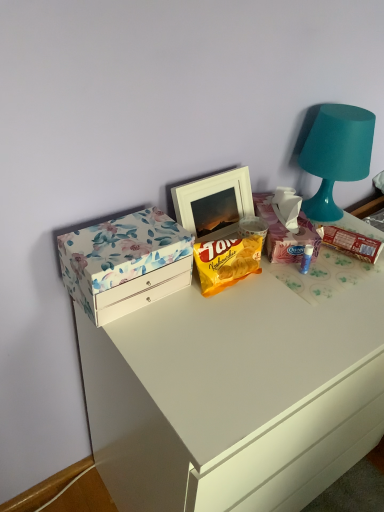
Find the location of a particular element. This screenshot has height=512, width=384. free space to the left of brown cardboard snack at right, marked as the second snack in a left-to-right arrangement is located at coordinates (301, 266).